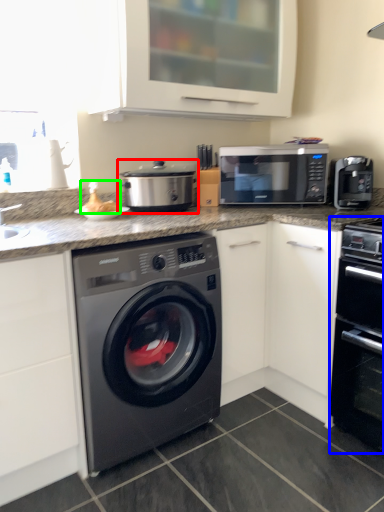
Question: Estimate the real-world distances between objects in this image. Which object is farther from appliance (highlighted by a red box), oven (highlighted by a blue box) or food (highlighted by a green box)?

Choices:
 (A) oven
 (B) food

Answer: (A)